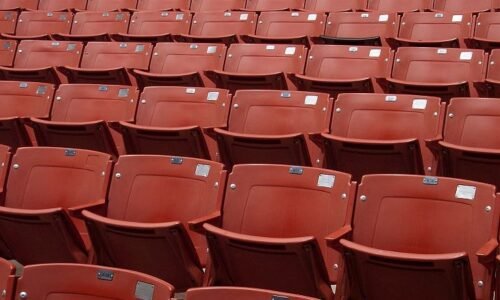
Locate an element on the screen. The height and width of the screenshot is (300, 500). second row from top of seats is located at coordinates (12, 23), (42, 24), (93, 26), (163, 23), (217, 23), (300, 26), (363, 24), (426, 26), (485, 26).